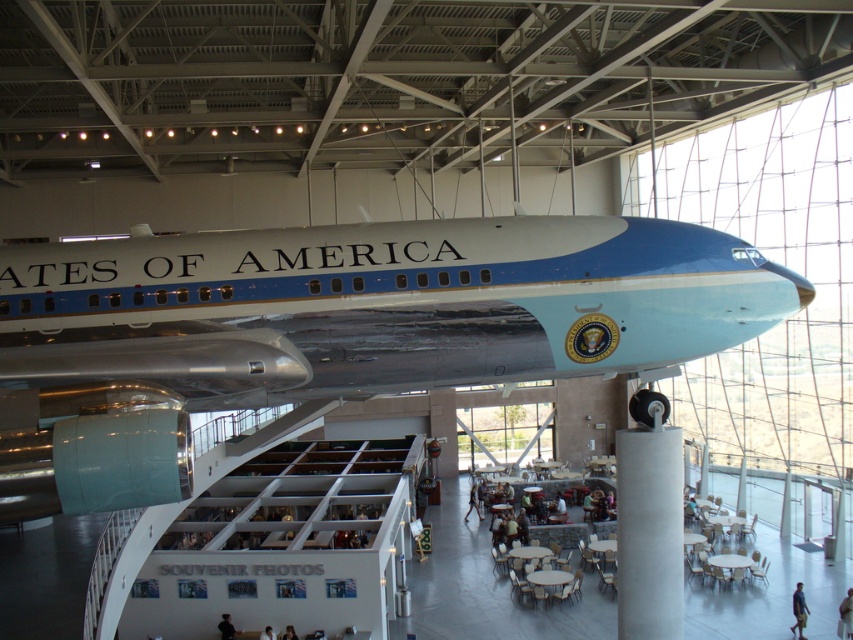
Question: Is blue jeans at lower right positioned at the back of light brown hair at lower center?

Choices:
 (A) yes
 (B) no

Answer: (A)

Question: Is black fabric person at lower center smaller than light brown hair at lower center?

Choices:
 (A) yes
 (B) no

Answer: (A)

Question: Does light brown leather jacket at lower right appear over white fabric shirt at lower center?

Choices:
 (A) yes
 (B) no

Answer: (B)

Question: Which object appears farthest from the camera in this image?

Choices:
 (A) white fabric shirt at lower center
 (B) blue metallic airplane at center
 (C) black fabric person at lower center
 (D) blue jeans at lower right

Answer: (D)

Question: Estimate the real-world distances between objects in this image. Which object is closer to the blue jeans at lower right?

Choices:
 (A) black fabric person at lower center
 (B) blue metallic airplane at center

Answer: (A)

Question: Which of the following is the closest to the observer?

Choices:
 (A) (233, 632)
 (B) (289, 627)

Answer: (B)